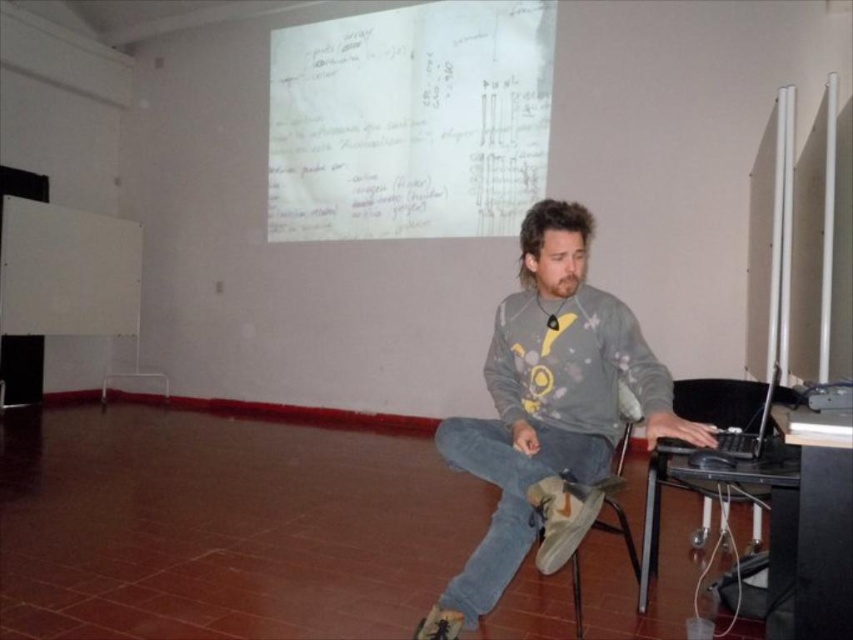
From the picture: You are a photographer standing in front of the scene. You want to capture a photo where both the gray cotton sweatshirt at center and the black matte laptop at right are clearly visible. Which object should you focus on first to ensure both are in focus?

You should focus on the gray cotton sweatshirt at center first because it is closer to you than the black matte laptop at right, so focusing on the closer object will help both be in focus.